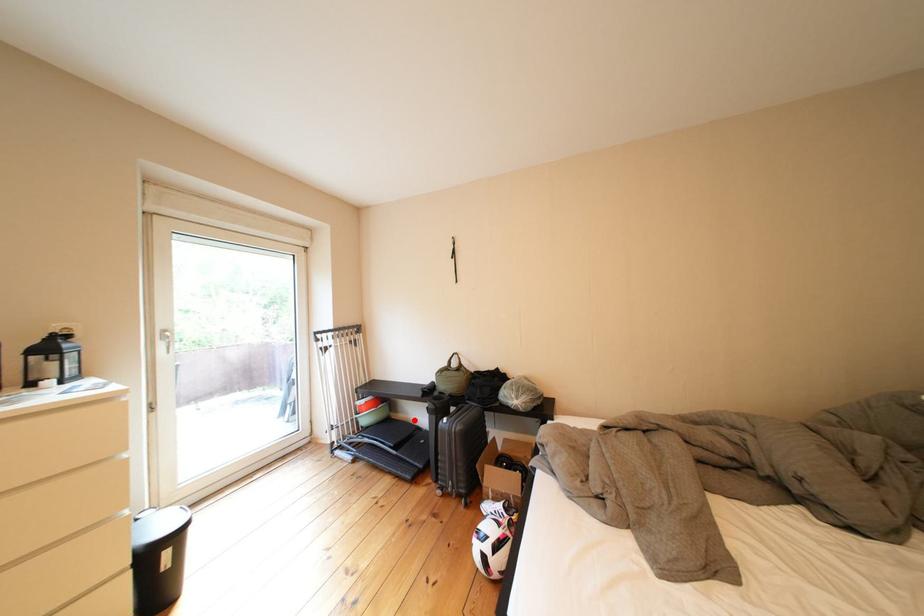
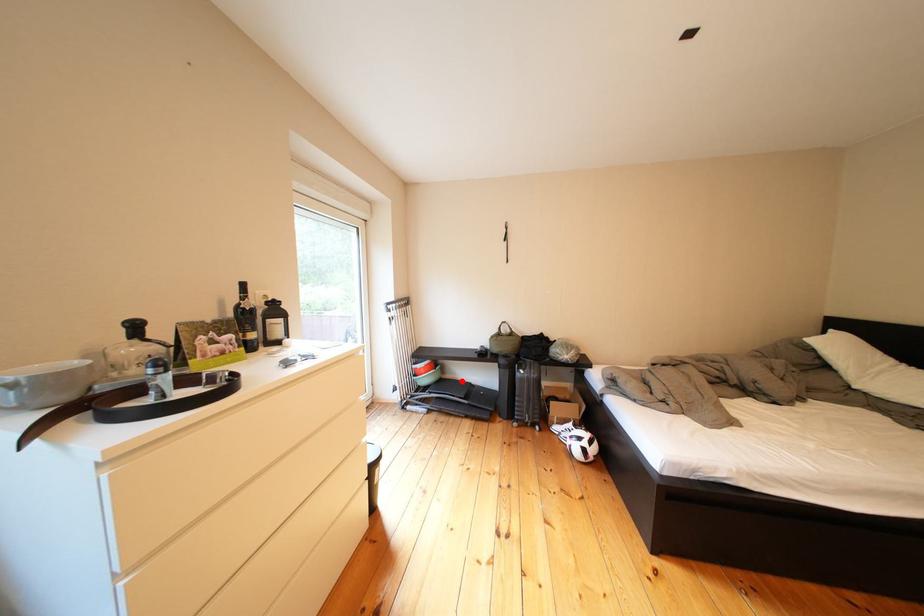
I am providing you with two images of the same scene from different viewpoints. A red point is marked on the first image and another point is marked on the second image. Do the highlighted points in image1 and image2 indicate the same real-world spot?

Yes